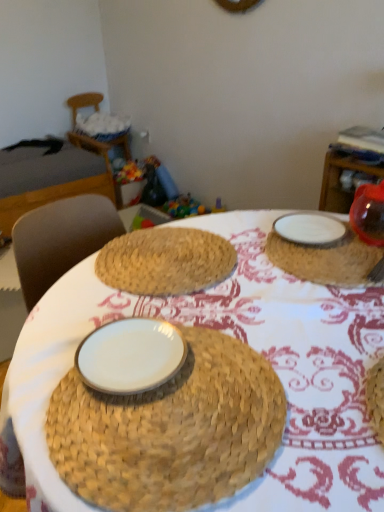
This screenshot has width=384, height=512. What do you see at coordinates (183, 207) in the screenshot? I see `translucent plastic toy at center` at bounding box center [183, 207].

Image resolution: width=384 pixels, height=512 pixels. What are the coordinates of `white matte plate at upper right, marked as the 2th plate in a front-to-back arrangement` in the screenshot? It's located at (310, 229).

This screenshot has width=384, height=512. In order to click on woven straw placemat at center in this screenshot , I will do `click(245, 342)`.

Who is smaller, white matte plate at upper right, which is the first plate from right to left, or dark gray fabric bed at left?

With smaller size is white matte plate at upper right, which is the first plate from right to left.

From a real-world perspective, who is located lower, white matte plate at upper right, which is the first plate from right to left, or dark gray fabric bed at left?

dark gray fabric bed at left is physically lower.

Locate an element on the screen. the 1st plate in front when counting from the dark gray fabric bed at left is located at coordinates (310, 229).

Does point (278, 234) lie in front of point (86, 346)?

That is False.

Between white ceramic plate at upper right and white glossy plate at center, the 2th plate viewed from the back, which one is positioned behind?

Positioned behind is white ceramic plate at upper right.

From a real-world perspective, is white ceramic plate at upper right positioned under white glossy plate at center, which ranks as the 1th plate in bottom-to-top order, based on gravity?

Yes.

Is white ceramic plate at upper right facing away from white glossy plate at center, which ranks as the 1th plate in bottom-to-top order?

No, white ceramic plate at upper right's orientation is not away from white glossy plate at center, which ranks as the 1th plate in bottom-to-top order.

Is white glossy plate at center, which ranks as the 1th plate in bottom-to-top order, positioned before translucent plastic toy at center?

Yes, white glossy plate at center, which ranks as the 1th plate in bottom-to-top order, is in front of translucent plastic toy at center.

Considering the relative positions of white glossy plate at center, the 2th plate viewed from the back, and translucent plastic toy at center in the image provided, is white glossy plate at center, the 2th plate viewed from the back, to the left or to the right of translucent plastic toy at center?

Based on their positions, white glossy plate at center, the 2th plate viewed from the back, is located to the left of translucent plastic toy at center.

From a real-world perspective, is white glossy plate at center, which ranks as the 1th plate in bottom-to-top order, located beneath translucent plastic toy at center?

No, from a real-world perspective, white glossy plate at center, which ranks as the 1th plate in bottom-to-top order, is not below translucent plastic toy at center.

Is white glossy plate at center, which ranks as the 1th plate in bottom-to-top order, wider or thinner than translucent plastic toy at center?

white glossy plate at center, which ranks as the 1th plate in bottom-to-top order, is thinner than translucent plastic toy at center.

Based on their sizes in the image, would you say white ceramic plate at upper right is bigger or smaller than woven straw placemat at center?

Considering their sizes, white ceramic plate at upper right takes up less space than woven straw placemat at center.

Is point (276, 251) closer to camera compared to point (245, 263)?

No.

Is white ceramic plate at upper right located outside woven straw placemat at center?

No, white ceramic plate at upper right is not outside of woven straw placemat at center.

Where is `tea set above the woven straw placemat at center (from the image's perspective)`? This screenshot has height=512, width=384. tea set above the woven straw placemat at center (from the image's perspective) is located at coordinates (334, 242).

Considering their positions, is white matte plate at upper right, arranged as the second plate when viewed from the left, located in front of or behind white glossy plate at center, the 2th plate viewed from the back?

Clearly, white matte plate at upper right, arranged as the second plate when viewed from the left, is behind white glossy plate at center, the 2th plate viewed from the back.

Can you tell me how much white matte plate at upper right, arranged as the second plate when viewed from the left, and white glossy plate at center, marked as the first plate in a left-to-right arrangement, differ in facing direction?

There is a 0.000173-degree angle between the facing directions of white matte plate at upper right, arranged as the second plate when viewed from the left, and white glossy plate at center, marked as the first plate in a left-to-right arrangement.

Which object is wider, white matte plate at upper right, which is the first plate from right to left, or white glossy plate at center, the first plate in the front-to-back sequence?

A: Wider between the two is white matte plate at upper right, which is the first plate from right to left.

Image resolution: width=384 pixels, height=512 pixels. I want to click on plate on the left side of white matte plate at upper right, which ranks as the second plate in bottom-to-top order, so click(130, 356).

Is woven straw placemat at center a part of white matte plate at upper right, the first plate when ordered from back to front?

No.

In the scene shown: Is white matte plate at upper right, which is the first plate from right to left, far from woven straw placemat at center?

No, white matte plate at upper right, which is the first plate from right to left, is in close proximity to woven straw placemat at center.

Which is more to the right, white matte plate at upper right, which is the first plate from right to left, or woven straw placemat at center?

From the viewer's perspective, white matte plate at upper right, which is the first plate from right to left, appears more on the right side.

From a real-world perspective, which is physically below, woven straw placemat at center or white woven basket at upper left?

white woven basket at upper left, from a real-world perspective.

Is white woven basket at upper left surrounded by woven straw placemat at center?

Actually, white woven basket at upper left is outside woven straw placemat at center.

Find the location of a particular element. This screenshot has width=384, height=512. basket on the left of woven straw placemat at center is located at coordinates (102, 126).

Is woven straw placemat at center oriented towards white woven basket at upper left?

Yes, woven straw placemat at center is facing white woven basket at upper left.

This screenshot has height=512, width=384. I want to click on plate that is the 1st one above the dark gray fabric bed at left (from a real-world perspective), so click(310, 229).

I want to click on tea set behind the white glossy plate at center, the first plate in the front-to-back sequence, so click(x=334, y=242).

Estimate the real-world distances between objects in this image. Which object is closer to white matte plate at upper right, which is the first plate from right to left, white glossy plate at center, which ranks as the 1th plate in bottom-to-top order, or translucent plastic toy at center?

white glossy plate at center, which ranks as the 1th plate in bottom-to-top order, is closer to white matte plate at upper right, which is the first plate from right to left.

Considering their positions, is white ceramic plate at upper right positioned further to white woven basket at upper left than white matte plate at upper right, which is the first plate from right to left?

Based on the image, white ceramic plate at upper right appears to be further to white woven basket at upper left.

From the image, which object appears to be farther from translucent plastic toy at center, dark gray fabric bed at left or white matte plate at upper right, which is the first plate from right to left?

white matte plate at upper right, which is the first plate from right to left, lies further to translucent plastic toy at center than the other object.

Based on their spatial positions, is white glossy plate at center, the 2th plate viewed from the right, or white ceramic plate at upper right closer to dark gray fabric bed at left?

The object closer to dark gray fabric bed at left is white ceramic plate at upper right.

Looking at the image, which one is located further to white matte plate at upper right, which is the first plate from right to left, woven straw placemat at center or white glossy plate at center, which is counted as the second plate, starting from the top?

white glossy plate at center, which is counted as the second plate, starting from the top, is further to white matte plate at upper right, which is the first plate from right to left.

From the image, which object appears to be farther from white matte plate at upper right, which is the first plate from right to left, woven straw placemat at center or translucent plastic toy at center?

translucent plastic toy at center is further to white matte plate at upper right, which is the first plate from right to left.

Looking at the image, which one is located further to white woven basket at upper left, translucent plastic toy at center or woven straw placemat at center?

Among the two, woven straw placemat at center is located further to white woven basket at upper left.

From the image, which object appears to be nearer to white ceramic plate at upper right, white matte plate at upper right, the first plate when ordered from back to front, or white woven basket at upper left?

white matte plate at upper right, the first plate when ordered from back to front, lies closer to white ceramic plate at upper right than the other object.

Identify the location of bed between woven straw placemat at center and white woven basket at upper left along the z-axis. (58, 169).

Locate an element on the screen. Image resolution: width=384 pixels, height=512 pixels. plate between white ceramic plate at upper right and dark gray fabric bed at left from front to back is located at coordinates pos(310,229).

Find the location of a particular element. The height and width of the screenshot is (512, 384). tea set between white glossy plate at center, the 2th plate viewed from the right, and white woven basket at upper left, along the z-axis is located at coordinates (334, 242).

Find the location of a particular element. The width and height of the screenshot is (384, 512). plate between white ceramic plate at upper right and translucent plastic toy at center along the z-axis is located at coordinates (310, 229).